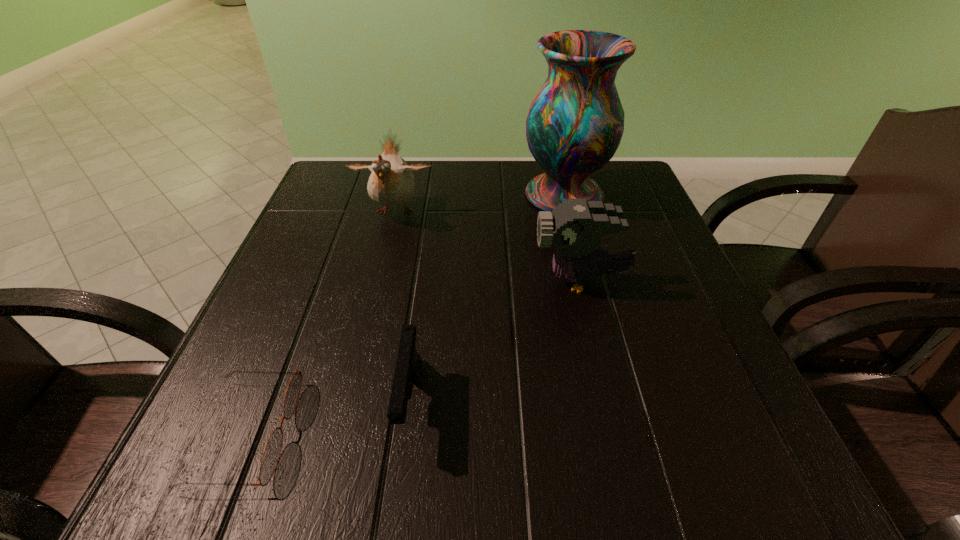
The image size is (960, 540). I want to click on object that stands as the third closest to the pistol, so click(391, 183).